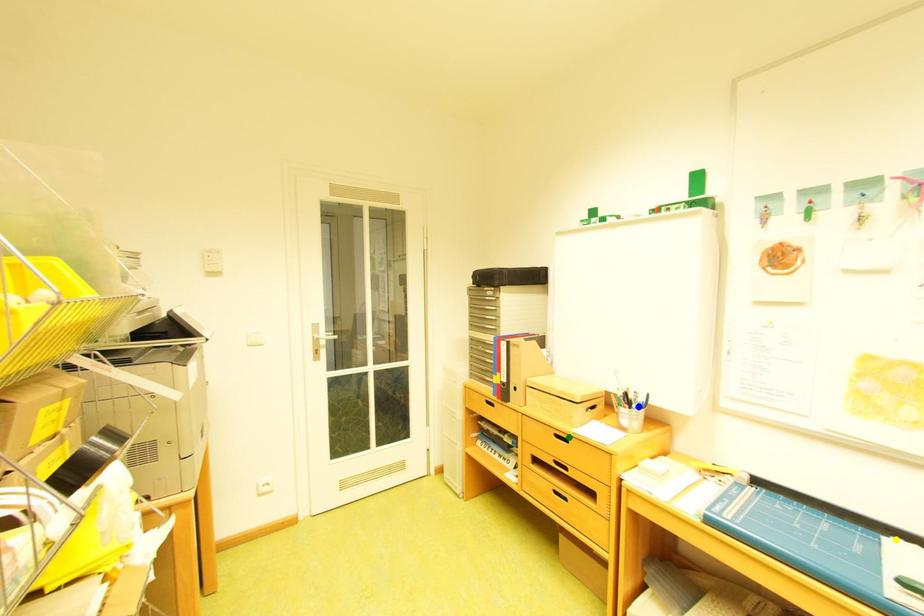
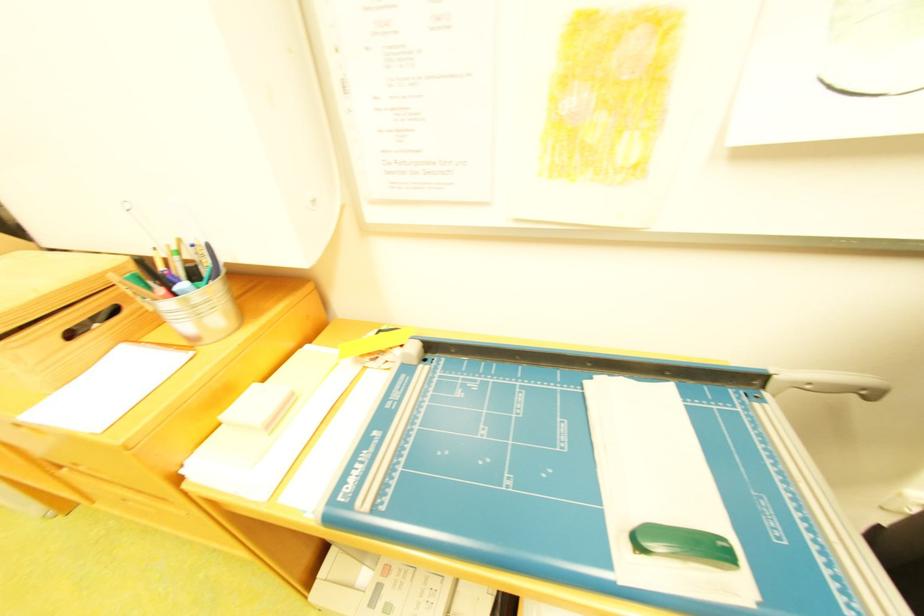
I am providing you with two images of the same scene from different viewpoints. Three points are marked in image1. Which point corresponds to a part or object that is occluded in image2?In image1, three points are marked. Which of them correspond to a part or object that is occluded in image2?Among the three points shown in image1, which one corresponds to a part or object that is no longer visible due to occlusion in image2?

green point